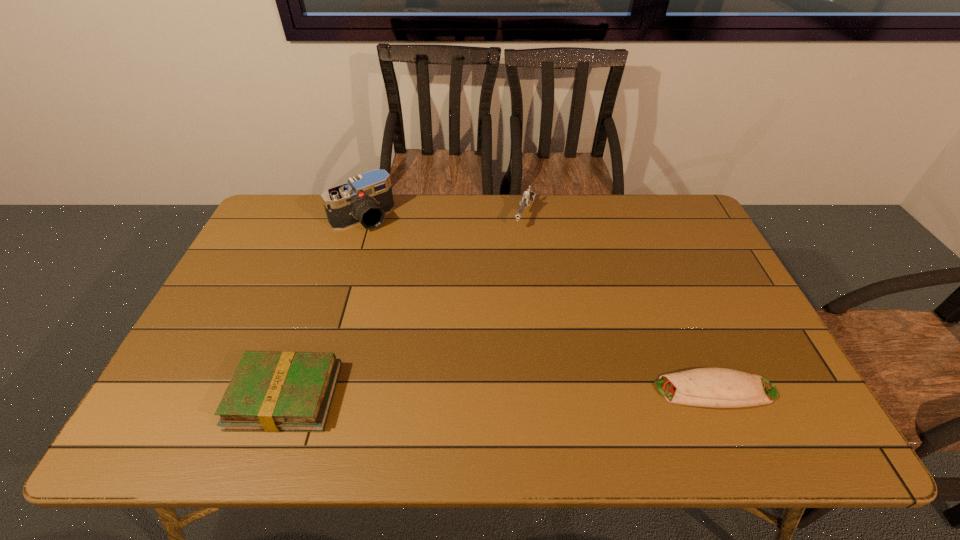
The height and width of the screenshot is (540, 960). In order to click on the third tallest object in this screenshot , I will do `click(288, 391)`.

Where is `burrito`? This screenshot has width=960, height=540. burrito is located at coordinates (704, 387).

The image size is (960, 540). Find the location of `the shortest object`. the shortest object is located at coordinates (704, 387).

Where is `camera`? The height and width of the screenshot is (540, 960). camera is located at coordinates (366, 198).

Locate an element on the screen. The width and height of the screenshot is (960, 540). the second object from right to left is located at coordinates (528, 196).

I want to click on gun, so click(528, 196).

You are a GUI agent. You are given a task and a screenshot of the screen. Output one action in this format:
    pyautogui.click(x=<x>, y=<y>)
    Task: Click on the free space located on the back of the third tallest object
    Image resolution: width=960 pixels, height=540 pixels.
    Given the screenshot: What is the action you would take?
    pyautogui.click(x=302, y=346)

Identify the location of vacant space positioned at the bitten end of the shortest object. (507, 390).

I want to click on vacant area situated 0.390m at the bitten end of the shortest object, so click(x=490, y=390).

Find the location of a particular element. The image size is (960, 540). vacant position located 0.380m at the bitten end of the shortest object is located at coordinates (494, 390).